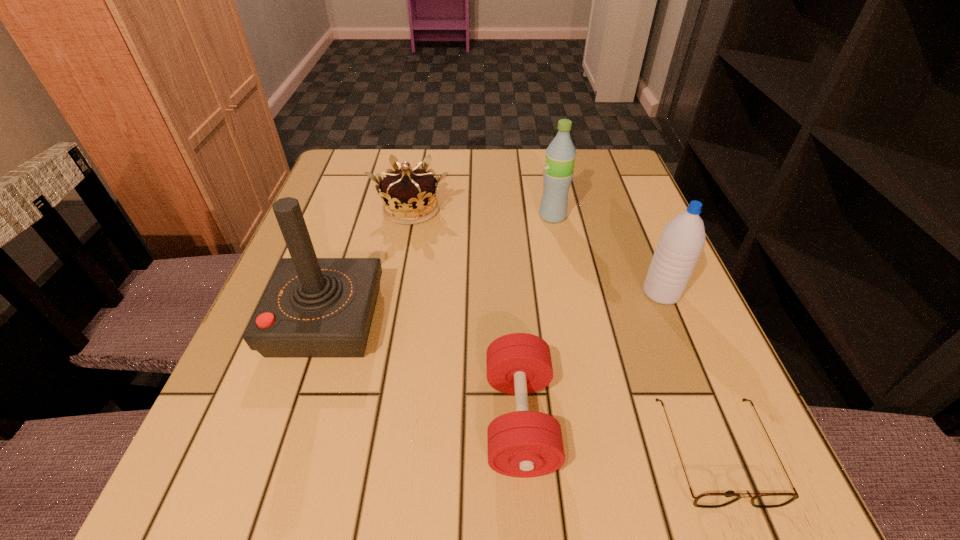
This screenshot has width=960, height=540. In order to click on joystick in this screenshot , I will do `click(313, 307)`.

You are a GUI agent. You are given a task and a screenshot of the screen. Output one action in this format:
    pyautogui.click(x=<x>, y=<y>)
    Task: Click on the farther water bottle
    This screenshot has height=540, width=960.
    Given the screenshot: What is the action you would take?
    pyautogui.click(x=560, y=156)

Find the location of `the fourth object from left to right`. the fourth object from left to right is located at coordinates (560, 156).

Where is `the nearer water bottle`? the nearer water bottle is located at coordinates tap(681, 242).

You are a GUI agent. You are given a task and a screenshot of the screen. Output one action in this format:
    pyautogui.click(x=<x>, y=<y>)
    Task: Click on the crown
    The image size is (960, 540).
    Given the screenshot: What is the action you would take?
    pyautogui.click(x=409, y=196)

Image resolution: width=960 pixels, height=540 pixels. What are the coordinates of `dumbbell` in the screenshot? It's located at (523, 444).

The height and width of the screenshot is (540, 960). I want to click on the third object from left to right, so click(523, 444).

The height and width of the screenshot is (540, 960). I want to click on the shortest object, so click(x=707, y=500).

This screenshot has height=540, width=960. Find the location of `blank space located on the rectangular base of the joystick`. blank space located on the rectangular base of the joystick is located at coordinates (536, 320).

At what (x,y) coordinates should I click in order to perform the action: click on vacant space positioned on the left of the third object from right to left. Please return your answer as a coordinate pair (x, y). This screenshot has height=540, width=960. Looking at the image, I should click on click(371, 216).